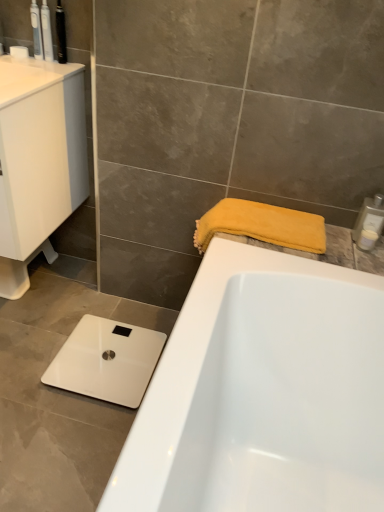
Question: From a real-world perspective, is white plastic soap dispenser at upper right, the first toiletry positioned from the bottom, over white glossy scale at lower left?

Choices:
 (A) yes
 (B) no

Answer: (A)

Question: Is white plastic soap dispenser at upper right, which is the fourth toiletry in left-to-right order, facing towards white glossy scale at lower left?

Choices:
 (A) yes
 (B) no

Answer: (B)

Question: From the image's perspective, is white plastic soap dispenser at upper right, which ranks as the second toiletry in right-to-left order, on top of white glossy scale at lower left?

Choices:
 (A) no
 (B) yes

Answer: (B)

Question: From a real-world perspective, is white plastic soap dispenser at upper right, the first toiletry positioned from the bottom, beneath white glossy scale at lower left?

Choices:
 (A) yes
 (B) no

Answer: (B)

Question: Does white plastic soap dispenser at upper right, which is the 5th toiletry in top-to-bottom order, have a smaller size compared to white glossy scale at lower left?

Choices:
 (A) no
 (B) yes

Answer: (B)

Question: Is white plastic soap dispenser at upper right, which is the fourth toiletry in left-to-right order, bigger than white glossy scale at lower left?

Choices:
 (A) no
 (B) yes

Answer: (A)

Question: Is metallic black toothbrush at upper left, the third toiletry positioned from the bottom, to the right of white glossy scale at lower left from the viewer's perspective?

Choices:
 (A) yes
 (B) no

Answer: (B)

Question: Considering the relative sizes of metallic black toothbrush at upper left, the third toiletry positioned from the bottom, and white glossy scale at lower left in the image provided, is metallic black toothbrush at upper left, the third toiletry positioned from the bottom, wider than white glossy scale at lower left?

Choices:
 (A) no
 (B) yes

Answer: (A)

Question: Does metallic black toothbrush at upper left, the third toiletry positioned from the bottom, appear on the left side of white glossy scale at lower left?

Choices:
 (A) no
 (B) yes

Answer: (B)

Question: Is metallic black toothbrush at upper left, the third toiletry positioned from the bottom, thinner than white glossy scale at lower left?

Choices:
 (A) no
 (B) yes

Answer: (B)

Question: Is metallic black toothbrush at upper left, arranged as the 3th toiletry when viewed from the left, outside white glossy scale at lower left?

Choices:
 (A) no
 (B) yes

Answer: (B)

Question: From the image's perspective, is metallic black toothbrush at upper left, acting as the 3th toiletry starting from the right, on white glossy scale at lower left?

Choices:
 (A) yes
 (B) no

Answer: (A)

Question: Is white glossy sink at left positioned before metallic black toothbrush at upper left, the third toiletry positioned from the bottom?

Choices:
 (A) yes
 (B) no

Answer: (A)